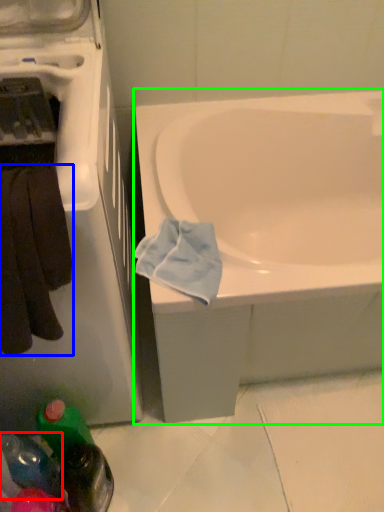
Question: Considering the real-world distances, which object is farthest from bottle (highlighted by a red box)? towel/napkin (highlighted by a blue box) or bathtub (highlighted by a green box)?

Choices:
 (A) towel/napkin
 (B) bathtub

Answer: (B)